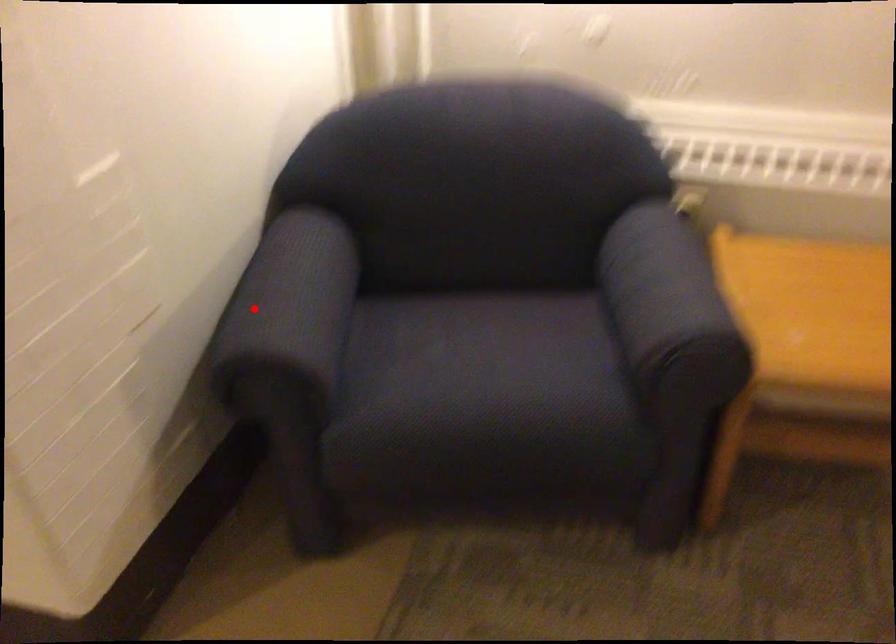
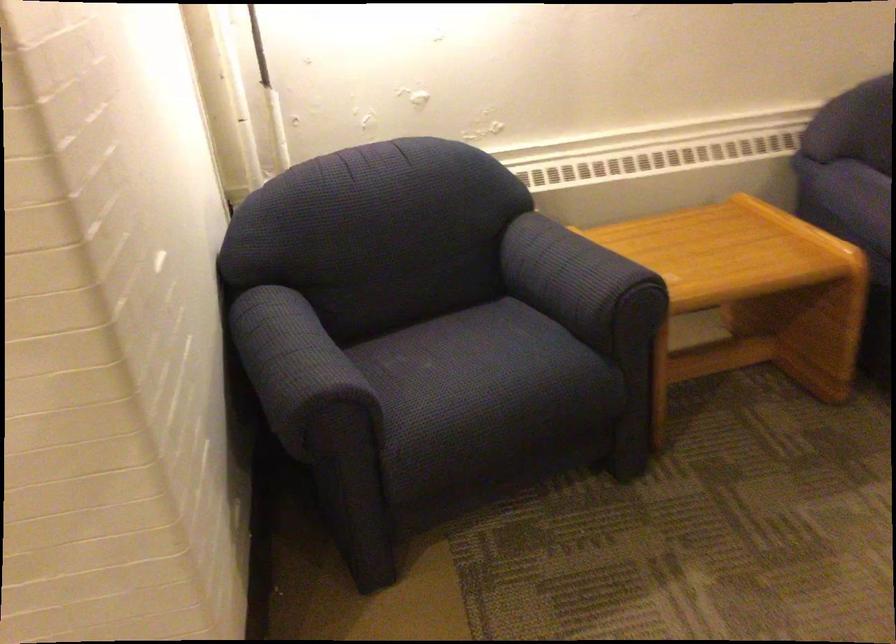
Question: I am providing you with two images of the same scene from different viewpoints. Given a red point in image1, look at the same physical point in image2. Is it:

Choices:
 (A) Closer to the viewpoint
 (B) Farther from the viewpoint

Answer: (B)